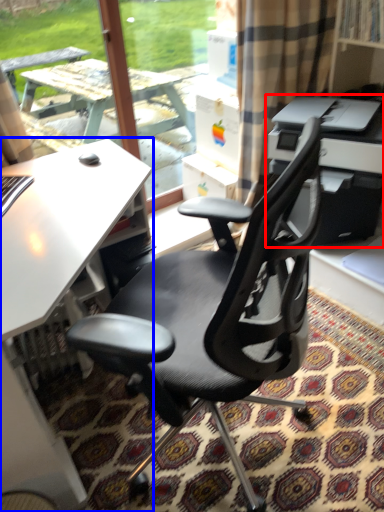
Question: Which point is closer to the camera, printer (highlighted by a red box) or desk (highlighted by a blue box)?

Choices:
 (A) printer
 (B) desk

Answer: (B)